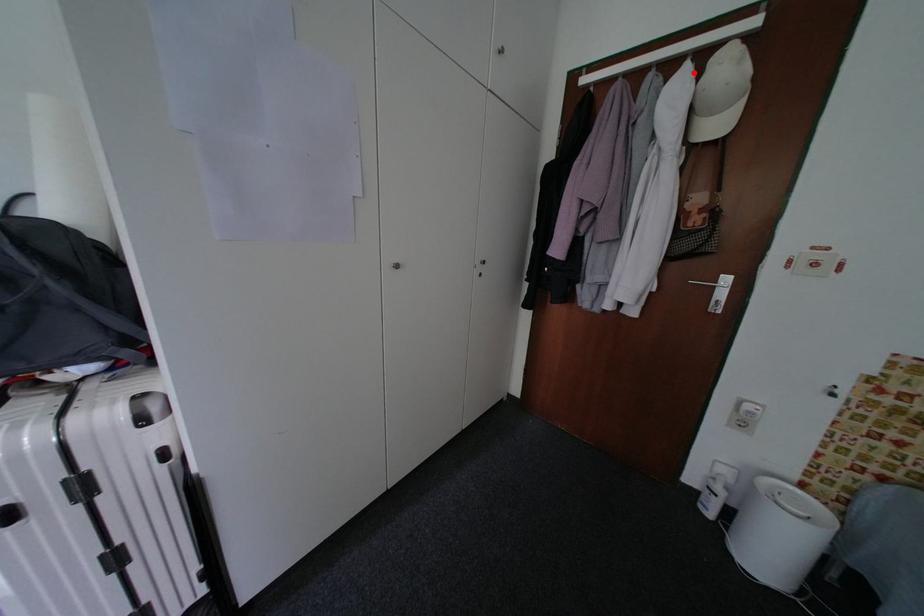
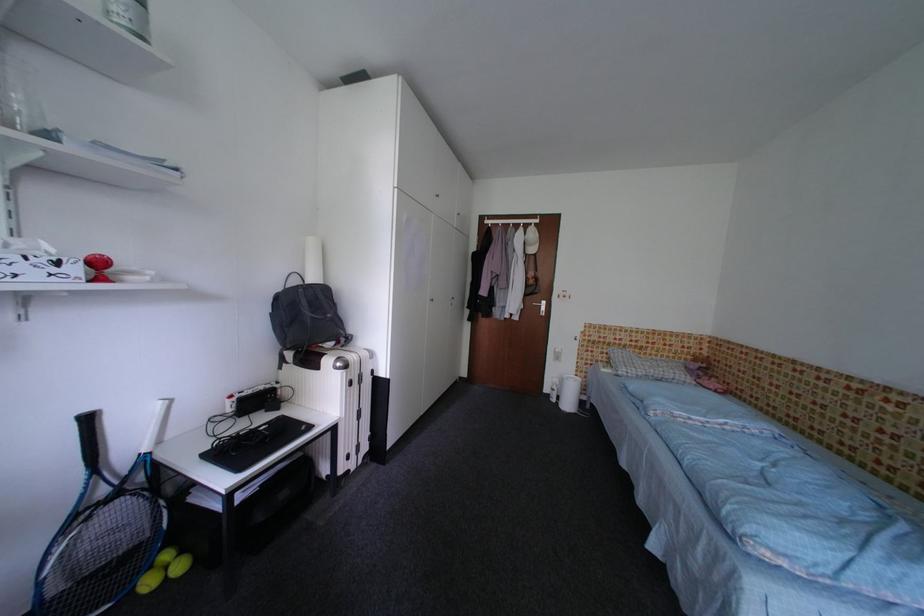
The point at the highlighted location is marked in the first image. Where is the corresponding point in the second image?

(529, 232)